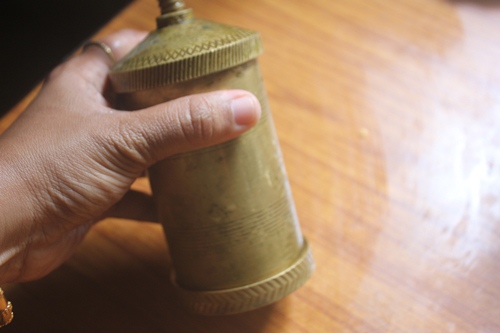
Identify the location of table. (364, 182).